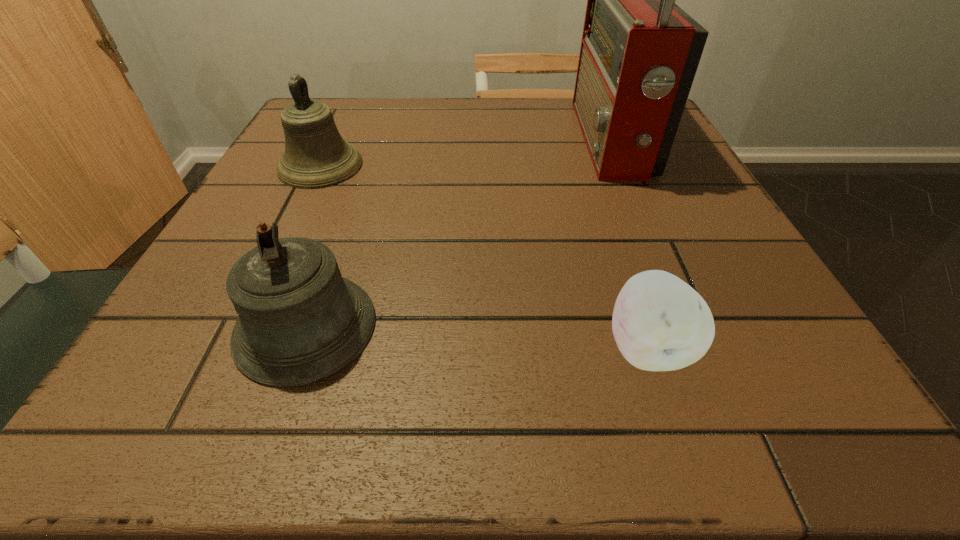
The image size is (960, 540). I want to click on radio receiver, so click(x=639, y=54).

Find the location of a particular element. The width and height of the screenshot is (960, 540). the farther bell is located at coordinates (316, 156).

You are a GUI agent. You are given a task and a screenshot of the screen. Output one action in this format:
    pyautogui.click(x=<x>, y=<y>)
    Task: Click on the nearer bell
    This screenshot has width=960, height=540.
    Given the screenshot: What is the action you would take?
    pyautogui.click(x=299, y=321)

What are the coordinates of `the shortest object` in the screenshot? It's located at (660, 323).

The height and width of the screenshot is (540, 960). In order to click on vacant space located 0.090m on the front-facing side of the radio receiver in this screenshot , I will do (x=539, y=140).

What are the coordinates of `free location located 0.170m on the front-facing side of the radio receiver` in the screenshot? It's located at (502, 140).

Locate an element on the screen. The image size is (960, 540). vacant space located 0.310m on the front-facing side of the radio receiver is located at coordinates (438, 140).

Where is `free point located 0.230m on the back of the farther bell`? Image resolution: width=960 pixels, height=540 pixels. free point located 0.230m on the back of the farther bell is located at coordinates (352, 100).

Find the location of a particular element. This screenshot has height=540, width=960. vacant space located on the back of the nearer bell is located at coordinates [x=351, y=197].

The height and width of the screenshot is (540, 960). Find the location of `vacant space located 0.280m on the back of the apple`. vacant space located 0.280m on the back of the apple is located at coordinates (598, 198).